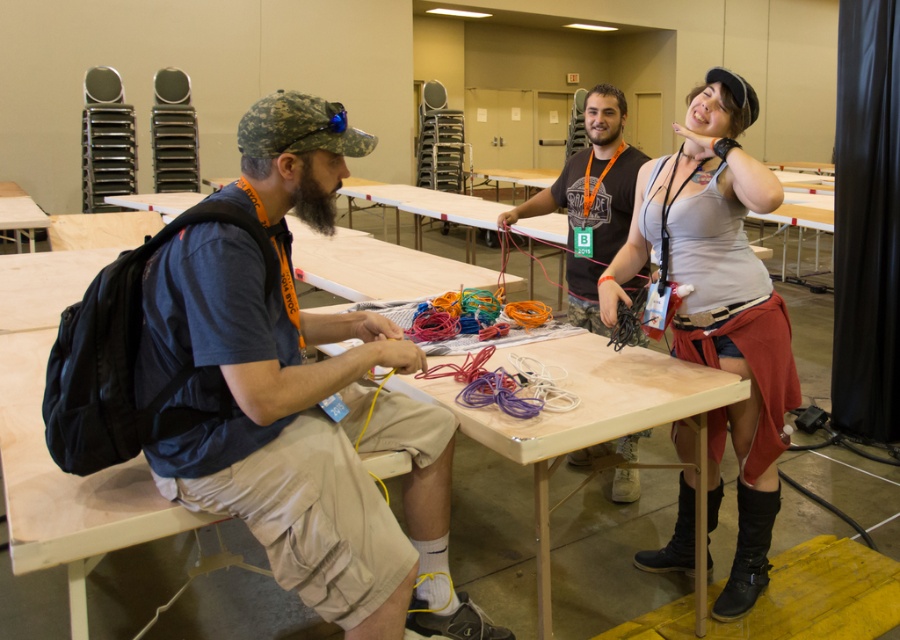
You are a security guard in the convention center. You notice two people in the scene, one wearing a gray fabric tank top at upper right and another in a camouflage tank top at center. According to the security protocol, you must ensure that all visitors are wearing their badges visibly. Which person is positioned lower and might have their badge less visible?

The gray fabric tank top at upper right is positioned below the camouflage tank top at center, so the person in the gray fabric tank top at upper right is lower and might have their badge less visible.

You are standing in the convention center and see the matte blue shirt at left and the camouflage tank top at center. Which person is taller?

The matte blue shirt at left is taller than the camouflage tank top at center.